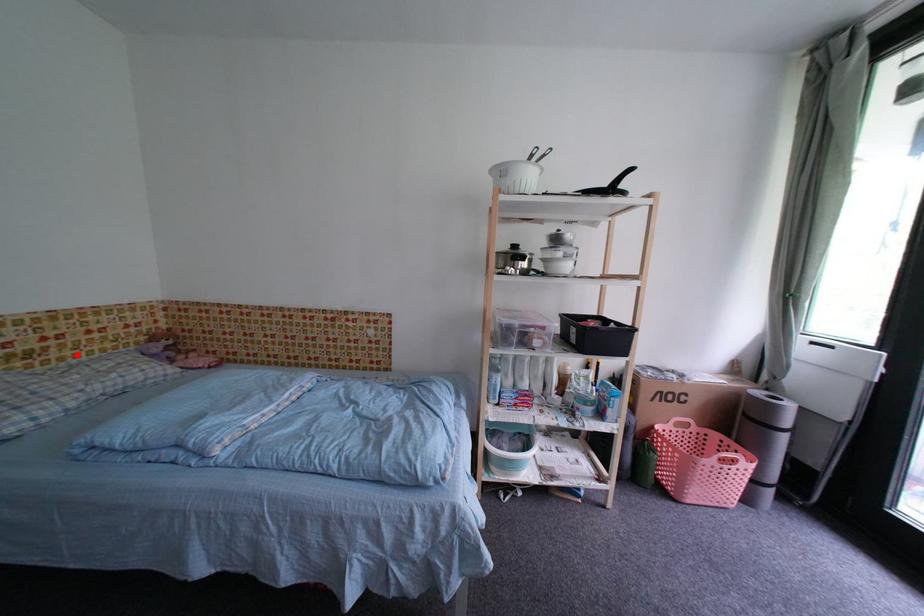
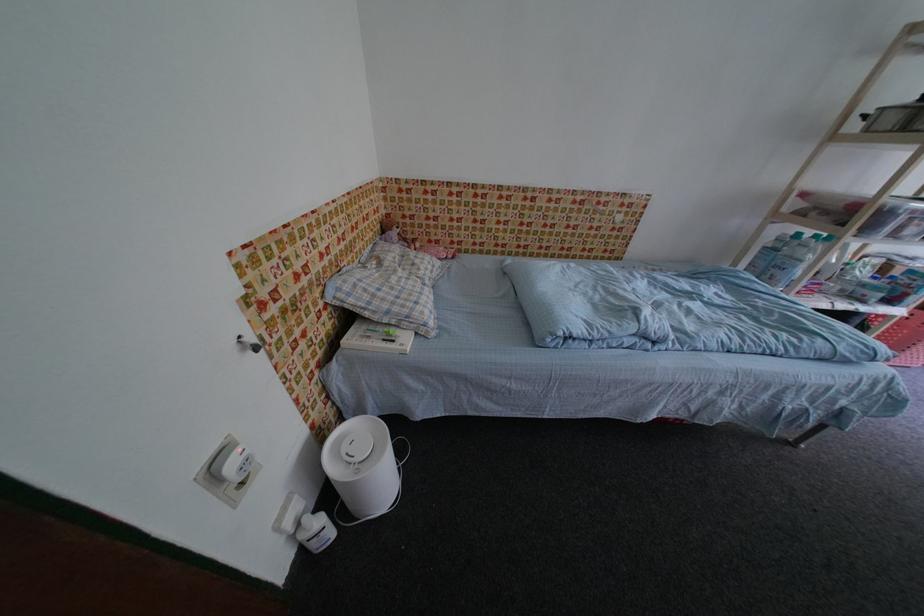
Question: I am providing you with two images of the same scene from different viewpoints. A red point is marked on the first image. Can you still see the location of the red point in image 2?

Choices:
 (A) Yes
 (B) No

Answer: (A)